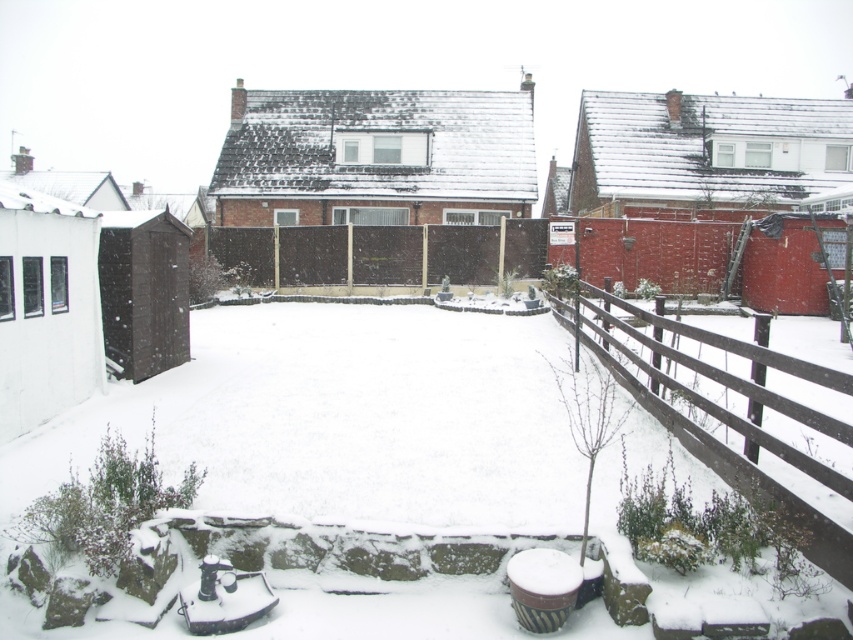
You are standing in the snowy backyard and want to walk towards the brown wooden fence at center. However, there is another brown wooden fence at lower right in your path. Based on their positions, which fence will you encounter first?

The brown wooden fence at lower right is in front of the brown wooden fence at center, so you will encounter the brown wooden fence at lower right first.

You are standing in the snowy backyard and want to head towards the brown wooden fence at lower right. Based on the coordinates provided, in which general direction should you walk from your current position at the center of the image?

The brown wooden fence at lower right is located at point 0.652 on the x axis and 0.865 on the y axis. Since the coordinates are based on the image frame where the center is 0.5 on both axes, the fence is to the lower right direction from the center. Therefore, you should walk towards the lower right direction to reach the brown wooden fence at lower right.